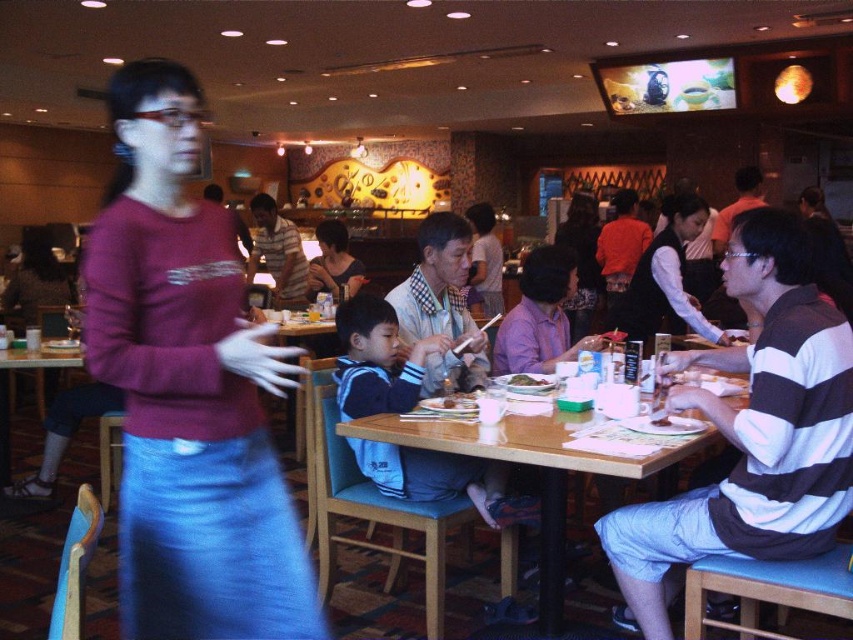
Question: Is matte black shirt at center positioned in front of green matte rice at table center?

Choices:
 (A) yes
 (B) no

Answer: (B)

Question: Which point is farther from the camera taking this photo?

Choices:
 (A) (543, 388)
 (B) (297, 234)

Answer: (B)

Question: Does striped shirt at center appear over matte black shirt at center?

Choices:
 (A) yes
 (B) no

Answer: (A)

Question: Which of these objects is positioned farthest from the striped cotton shirt at right?

Choices:
 (A) wooden table at center
 (B) green matte rice at table center
 (C) matte black shirt at center
 (D) striped shirt at center

Answer: (D)

Question: Which of the following is the closest to the observer?

Choices:
 (A) striped shirt at center
 (B) wooden table at center
 (C) matte purple sweater at center

Answer: (C)

Question: Does striped cotton shirt at right have a greater width compared to striped shirt at center?

Choices:
 (A) no
 (B) yes

Answer: (A)